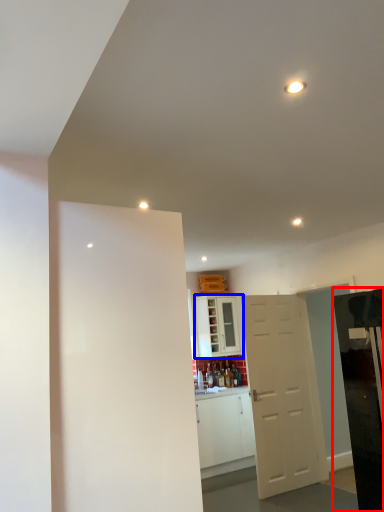
Question: Which of the following is the farthest to the observer, appliance (highlighted by a red box) or cabinetry (highlighted by a blue box)?

Choices:
 (A) appliance
 (B) cabinetry

Answer: (B)